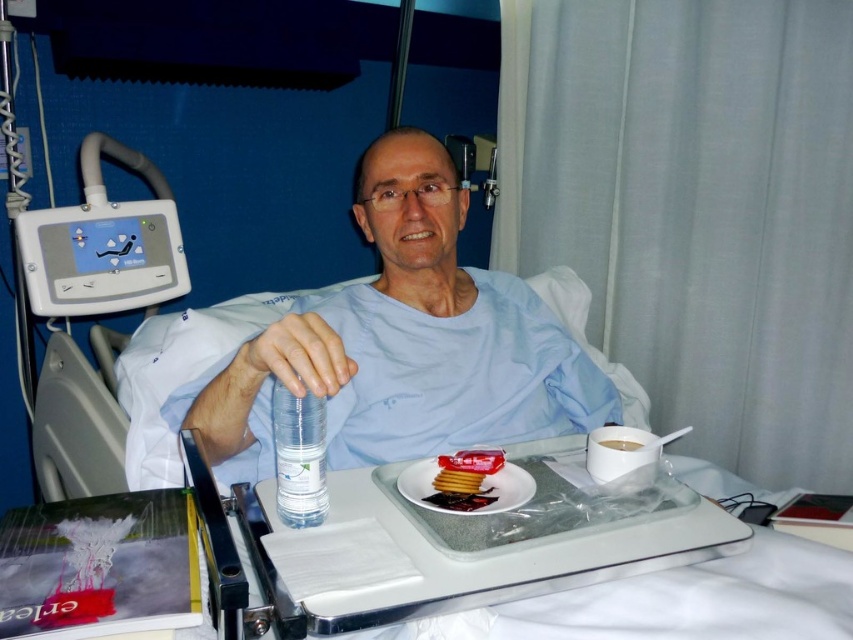
Question: Among these objects, which one is farthest from the camera?

Choices:
 (A) white glossy cup at upper right
 (B) glossy plastic jam at center

Answer: (A)

Question: Can you confirm if transparent plastic bottle at center is positioned above white glossy cup at upper right?

Choices:
 (A) yes
 (B) no

Answer: (A)

Question: Which of the following is the closest to the observer?

Choices:
 (A) white glossy cup at upper right
 (B) matte plastic water bottle at center

Answer: (B)

Question: Is matte plastic water bottle at center to the left of translucent plastic crackers at tray center from the viewer's perspective?

Choices:
 (A) yes
 (B) no

Answer: (A)

Question: Which of the following is the farthest from the observer?

Choices:
 (A) (453, 492)
 (B) (288, 378)
 (C) (448, 506)
 (D) (611, 442)

Answer: (D)

Question: Does clear plastic tray at center come in front of translucent plastic crackers at tray center?

Choices:
 (A) yes
 (B) no

Answer: (B)